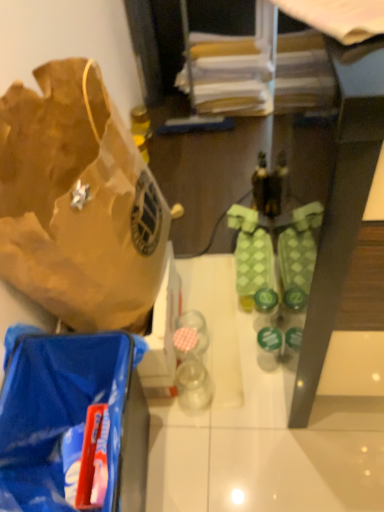
Question: Does green textured socks at center turn towards green matte bottle at center?

Choices:
 (A) yes
 (B) no

Answer: (B)

Question: Does green textured socks at center have a smaller size compared to green matte bottle at center?

Choices:
 (A) no
 (B) yes

Answer: (A)

Question: From the image's perspective, is green textured socks at center beneath green matte bottle at center?

Choices:
 (A) no
 (B) yes

Answer: (A)

Question: Can you confirm if green textured socks at center is taller than green matte bottle at center?

Choices:
 (A) yes
 (B) no

Answer: (A)

Question: Can you see green textured socks at center touching green matte bottle at center?

Choices:
 (A) no
 (B) yes

Answer: (A)

Question: Is green textured socks at center to the right of green matte bottle at center from the viewer's perspective?

Choices:
 (A) no
 (B) yes

Answer: (A)

Question: Are green matte bottle at center and brown paper bag at left beside each other?

Choices:
 (A) no
 (B) yes

Answer: (A)

Question: Considering the relative sizes of green matte bottle at center and brown paper bag at left in the image provided, is green matte bottle at center bigger than brown paper bag at left?

Choices:
 (A) yes
 (B) no

Answer: (B)

Question: Can we say green matte bottle at center lies outside brown paper bag at left?

Choices:
 (A) yes
 (B) no

Answer: (A)

Question: Is green matte bottle at center wider than brown paper bag at left?

Choices:
 (A) no
 (B) yes

Answer: (A)

Question: Can you confirm if green matte bottle at center is smaller than brown paper bag at left?

Choices:
 (A) no
 (B) yes

Answer: (B)

Question: Is green matte bottle at center further to camera compared to brown paper bag at left?

Choices:
 (A) no
 (B) yes

Answer: (B)

Question: Does green matte bottle at center appear on the left side of blue plastic bag at lower left?

Choices:
 (A) no
 (B) yes

Answer: (A)